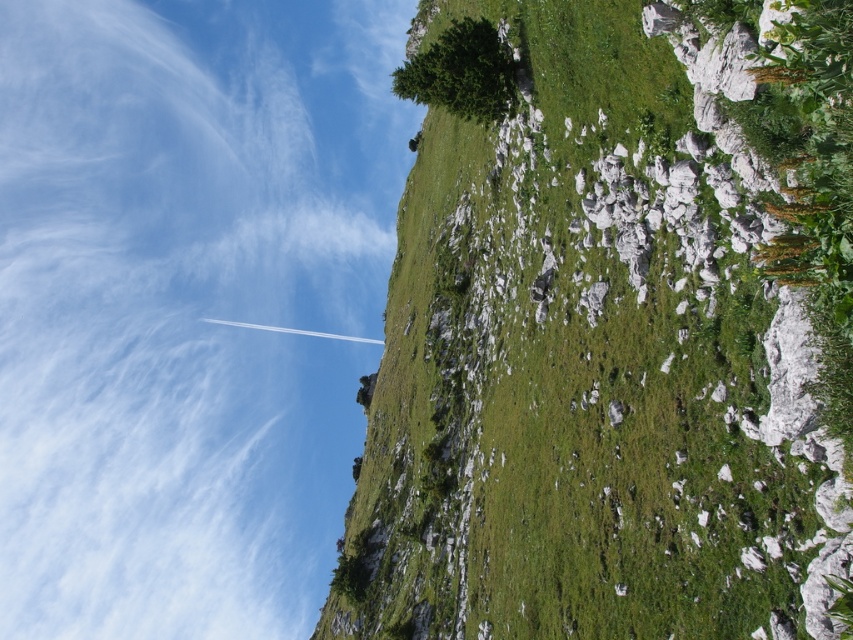
Based on the photo, who is more distant from viewer, (x=404, y=625) or (x=167, y=186)?

Positioned behind is point (x=167, y=186).

This screenshot has height=640, width=853. Find the location of `green grassy hillside at upper center`. green grassy hillside at upper center is located at coordinates (613, 330).

Where is `green grassy hillside at upper center`? The width and height of the screenshot is (853, 640). green grassy hillside at upper center is located at coordinates (613, 330).